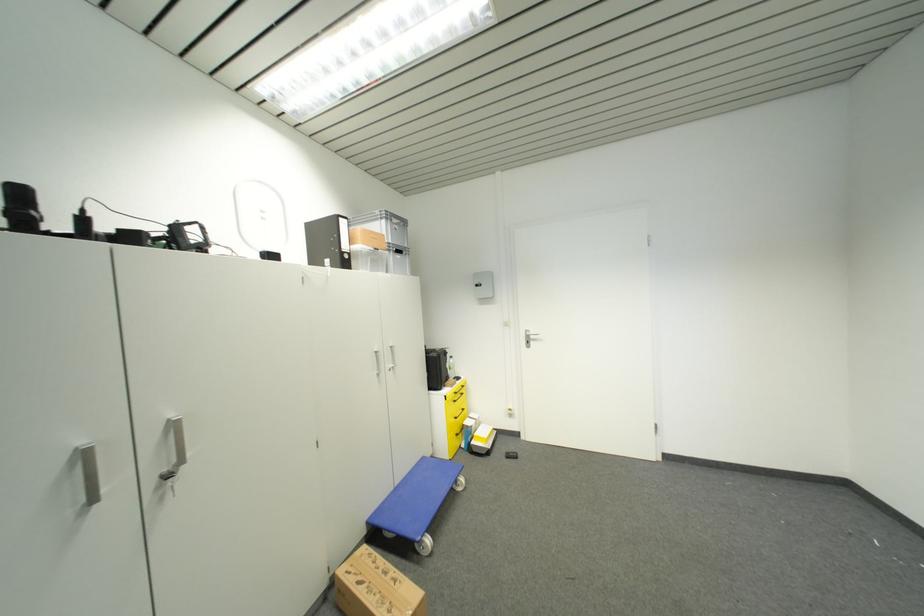
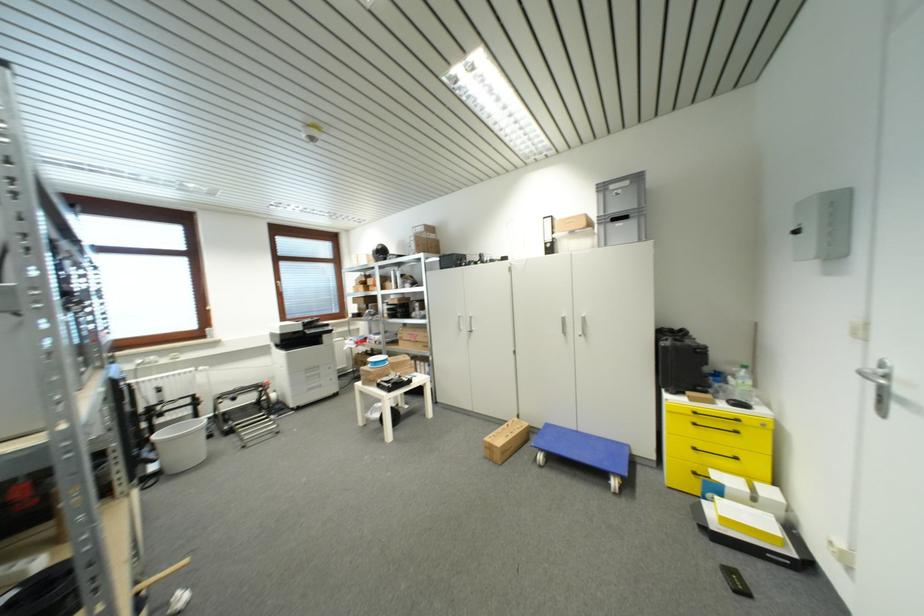
In the second image, find the point that corresponds to the point at 372,525 in the first image.

(552, 427)